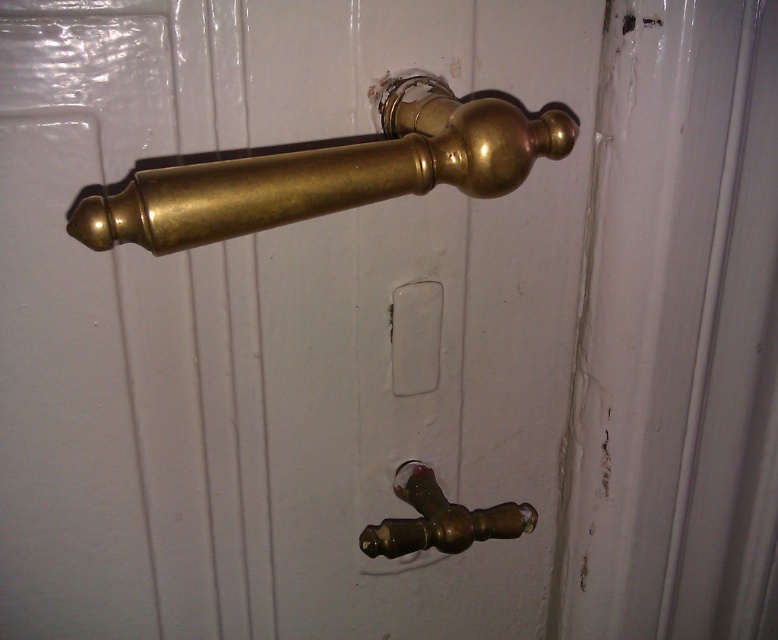
Question: Which point appears closest to the camera in this image?

Choices:
 (A) (440, 528)
 (B) (407, 76)

Answer: (B)

Question: Can you confirm if brass/polished handle at center is positioned to the right of brass/polished metal faucet at lower center?

Choices:
 (A) yes
 (B) no

Answer: (B)

Question: Which point appears farthest from the camera in this image?

Choices:
 (A) (468, 100)
 (B) (401, 496)

Answer: (B)

Question: Is brass/polished handle at center to the right of brass/polished metal faucet at lower center from the viewer's perspective?

Choices:
 (A) yes
 (B) no

Answer: (B)

Question: Is brass/polished handle at center positioned in front of brass/polished metal faucet at lower center?

Choices:
 (A) no
 (B) yes

Answer: (B)

Question: Which object is closer to the camera taking this photo?

Choices:
 (A) brass/polished handle at center
 (B) brass/polished metal faucet at lower center

Answer: (A)